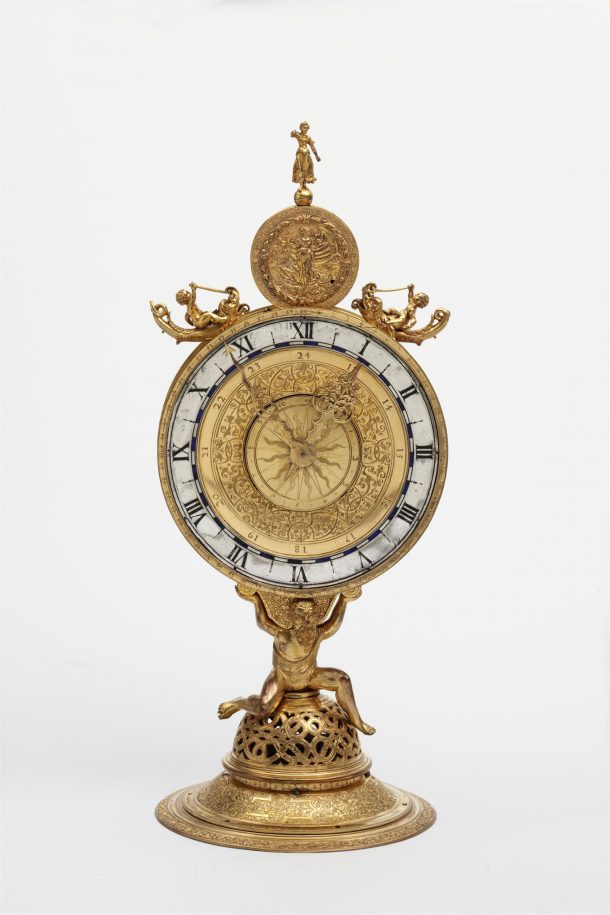
The width and height of the screenshot is (610, 915). In order to click on clock in this screenshot , I will do `click(417, 499)`.